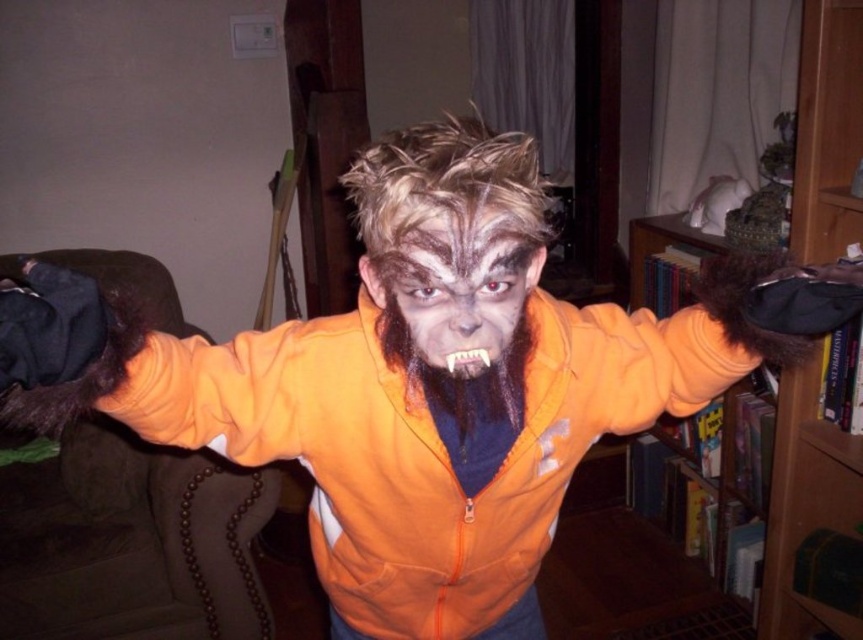
Question: Which point is farther to the camera?

Choices:
 (A) (385, 353)
 (B) (408, 237)
 (C) (786, 461)

Answer: (C)

Question: Among these objects, which one is farthest from the camera?

Choices:
 (A) wooden bookshelf at right
 (B) matte orange fur at center
 (C) brown fur at center

Answer: (A)

Question: Is the position of wooden bookshelf at right less distant than that of brown fur at center?

Choices:
 (A) no
 (B) yes

Answer: (A)

Question: Which of the following is the farthest from the observer?

Choices:
 (A) wooden bookshelf at right
 (B) brown fur at center

Answer: (A)

Question: Is matte orange fur at center to the right of brown fur at center from the viewer's perspective?

Choices:
 (A) yes
 (B) no

Answer: (B)

Question: Observing the image, what is the correct spatial positioning of wooden bookshelf at right in reference to matte orange fur at center?

Choices:
 (A) below
 (B) above

Answer: (A)